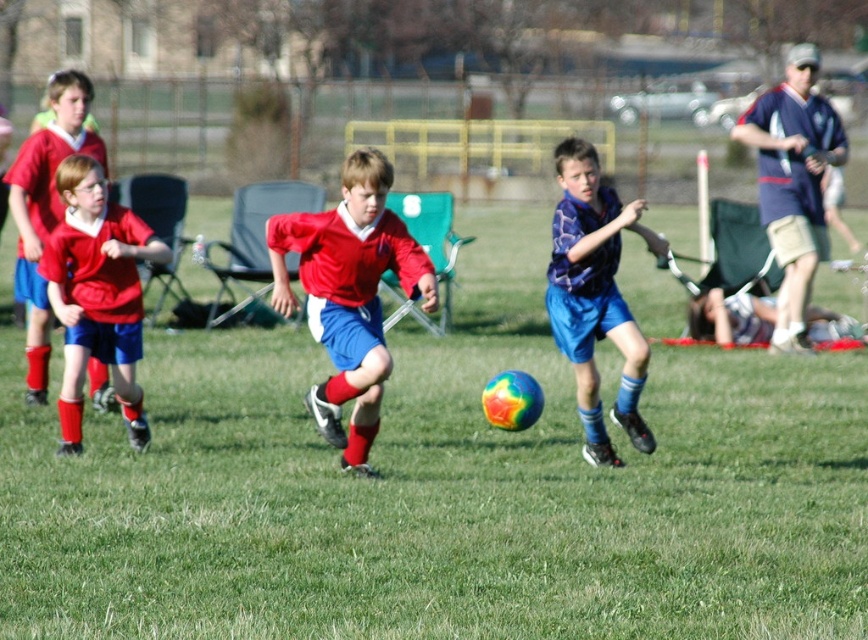
Does matte red shirt at center have a larger size compared to blue fabric cap at upper right?

Yes, matte red shirt at center is bigger than blue fabric cap at upper right.

How far apart are matte red shirt at center and blue fabric cap at upper right?

A distance of 5.58 meters exists between matte red shirt at center and blue fabric cap at upper right.

Between point (398, 272) and point (819, 147), which one is positioned in front?

Point (398, 272) is in front.

This screenshot has width=868, height=640. In order to click on matte red shirt at center in this screenshot , I will do `click(349, 294)`.

Who is positioned more to the right, matte red shirt at center or matte red jersey at left?

Positioned to the right is matte red shirt at center.

Between point (386, 186) and point (38, 385), which one is positioned in front?

Point (386, 186) is in front.

Locate an element on the screen. matte red shirt at center is located at coordinates (349, 294).

Who is positioned more to the left, smooth green grass at center or blue fabric cap at upper right?

smooth green grass at center is more to the left.

Between smooth green grass at center and blue fabric cap at upper right, which one has less height?

blue fabric cap at upper right is shorter.

Where is `smooth green grass at center`? This screenshot has height=640, width=868. smooth green grass at center is located at coordinates (444, 490).